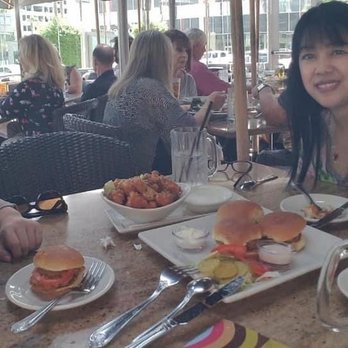
The image size is (348, 348). Identify the location of spoon. (197, 286).